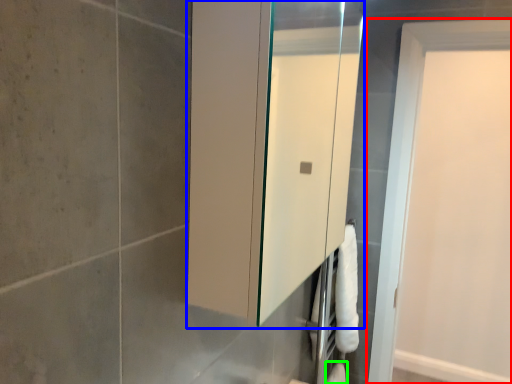
Question: Which object is positioned farthest from door (highlighted by a red box)? Select from medicine cabinet (highlighted by a blue box) and toilet paper (highlighted by a green box).

Choices:
 (A) medicine cabinet
 (B) toilet paper

Answer: (A)